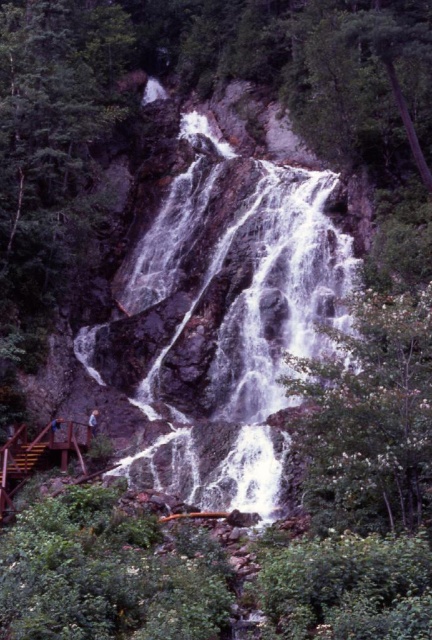
You are a photographer planning to capture the waterfall and the tree in the same frame. Given that the white frothy water at center is taller than the green leafy tree at center, which object should you focus on first to ensure both are visible in your photo?

You should focus on the white frothy water at center first because it is taller than the green leafy tree at center, so positioning the camera to include its full height will naturally include the shorter tree in the frame.

You are a hiker planning to take a photo of the brown wooden stairs at lower left. To avoid having the green leafy tree at center blocking the view, where should you position yourself relative to the stairs?

The green leafy tree at center is positioned over the brown wooden stairs at lower left. To avoid the tree blocking the view, you should position yourself behind the stairs, so the tree is behind you and out of the frame.

From the picture: You are standing at the base of the waterfall and want to take a photo of both the wooden staircase and the tourists at the top. The camera you are using has a limited field of view. Based on the positions of point (330, 298) and point (9, 464), which point is closer to you and should be framed first?

Point (330, 298) is closer to you and should be framed first because it is further to the viewer than point (9, 464).